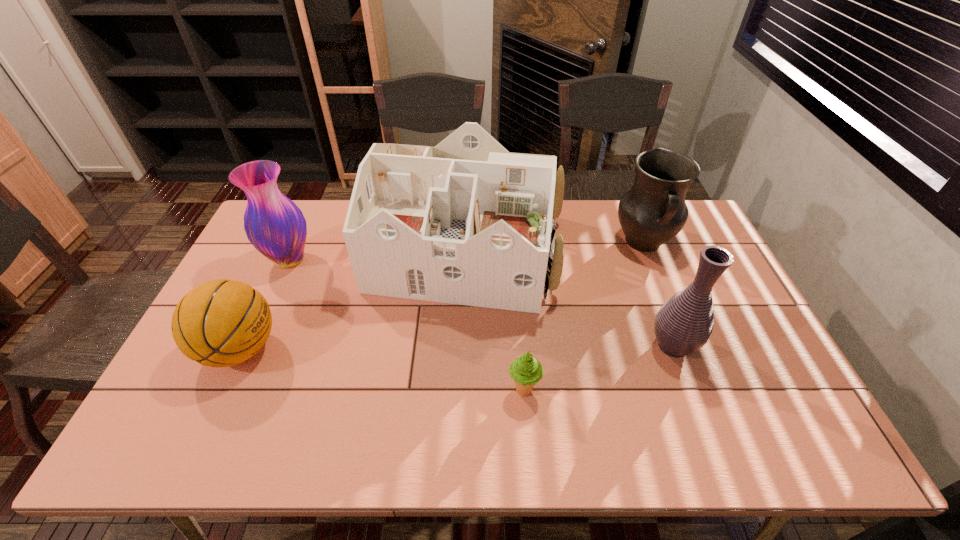
The image size is (960, 540). I want to click on dollhouse, so click(466, 222).

In order to click on the nearer vase in this screenshot , I will do `click(683, 325)`.

Find the location of a particular element. the farther vase is located at coordinates (275, 226).

Identify the location of pitcher. This screenshot has width=960, height=540. coord(653,211).

Locate an element on the screen. This screenshot has width=960, height=540. the fifth tallest object is located at coordinates (221, 323).

At what (x,y) coordinates should I click in order to perform the action: click on icecream. Please return your answer as a coordinate pair (x, y). The image size is (960, 540). Looking at the image, I should click on (525, 370).

Image resolution: width=960 pixels, height=540 pixels. Identify the location of free space located on the left of the dollhouse. (266, 251).

You are a GUI agent. You are given a task and a screenshot of the screen. Output one action in this format:
    pyautogui.click(x=<x>, y=<y>)
    Task: Click on the free space located 0.070m on the front of the right vase
    
    Given the screenshot: What is the action you would take?
    pos(689,391)

This screenshot has width=960, height=540. Identify the location of free region located on the front of the farther vase. (246, 358).

Find the location of `free space located on the handle side of the pitcher`. free space located on the handle side of the pitcher is located at coordinates (657, 277).